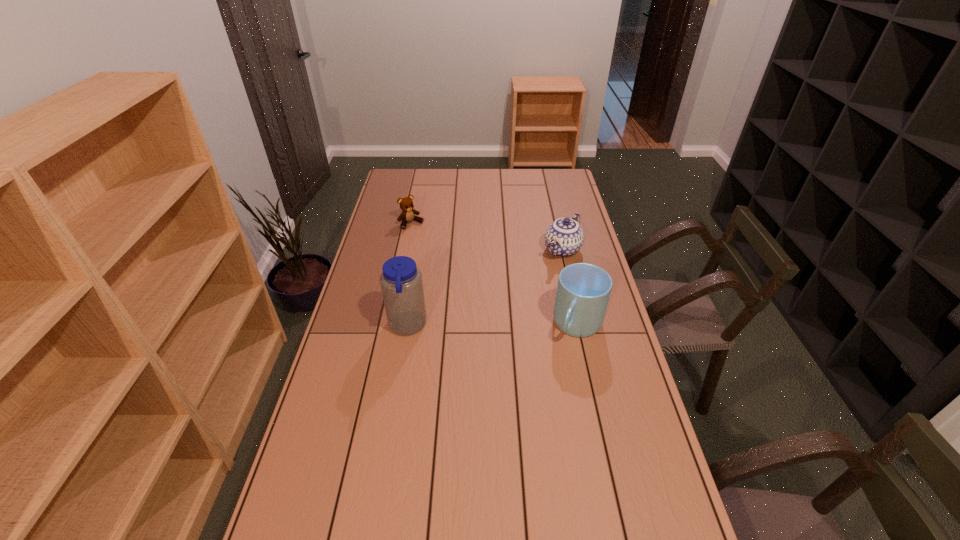
In the image, there is a desktop. Where is `vacant area at the far edge`? vacant area at the far edge is located at coordinates (463, 173).

You are a GUI agent. You are given a task and a screenshot of the screen. Output one action in this format:
    pyautogui.click(x=<x>, y=<y>)
    Task: Click on the vacant area at the left edge
    The width and height of the screenshot is (960, 540).
    Given the screenshot: What is the action you would take?
    pyautogui.click(x=394, y=240)

The width and height of the screenshot is (960, 540). In order to click on vacant space at the right edge of the desktop in this screenshot , I will do `click(592, 383)`.

Locate an element on the screen. vacant area at the far left corner of the desktop is located at coordinates (412, 190).

In the image, there is a desktop. Find the location of `vacant area at the near right corner`. vacant area at the near right corner is located at coordinates (631, 512).

You are a GUI agent. You are given a task and a screenshot of the screen. Output one action in this format:
    pyautogui.click(x=<x>, y=<y>)
    Task: Click on the empty location between the third nearest object and the teddy bear
    
    Given the screenshot: What is the action you would take?
    pyautogui.click(x=487, y=237)

This screenshot has width=960, height=540. I want to click on free space between the farthest object and the second shortest object, so click(x=487, y=237).

Identify the location of vacant point located between the farthest object and the third nearest object. (487, 237).

Identify the location of free area in between the tallest object and the third shortest object. The height and width of the screenshot is (540, 960). (492, 326).

Identify the location of vacant point located between the mug and the shortest object. Image resolution: width=960 pixels, height=540 pixels. (494, 274).